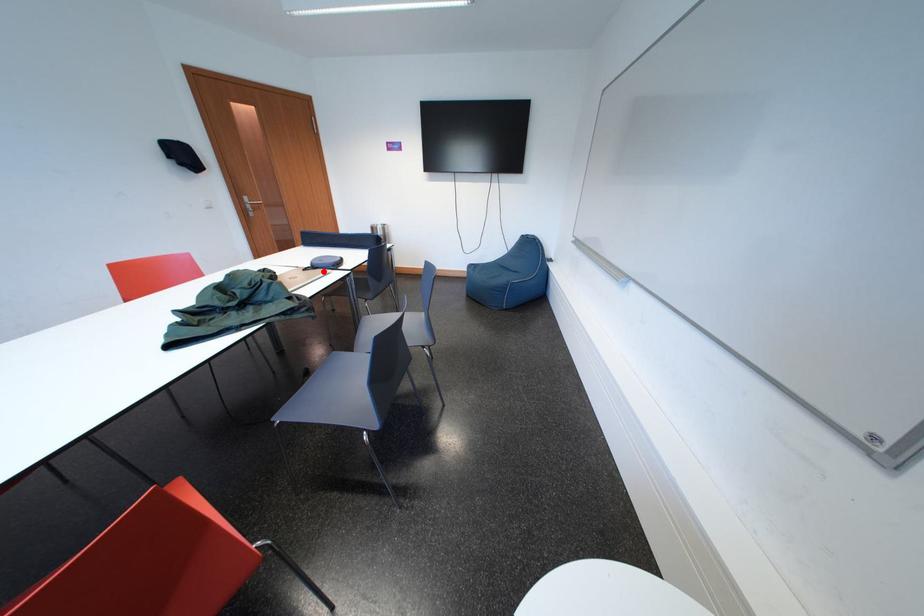
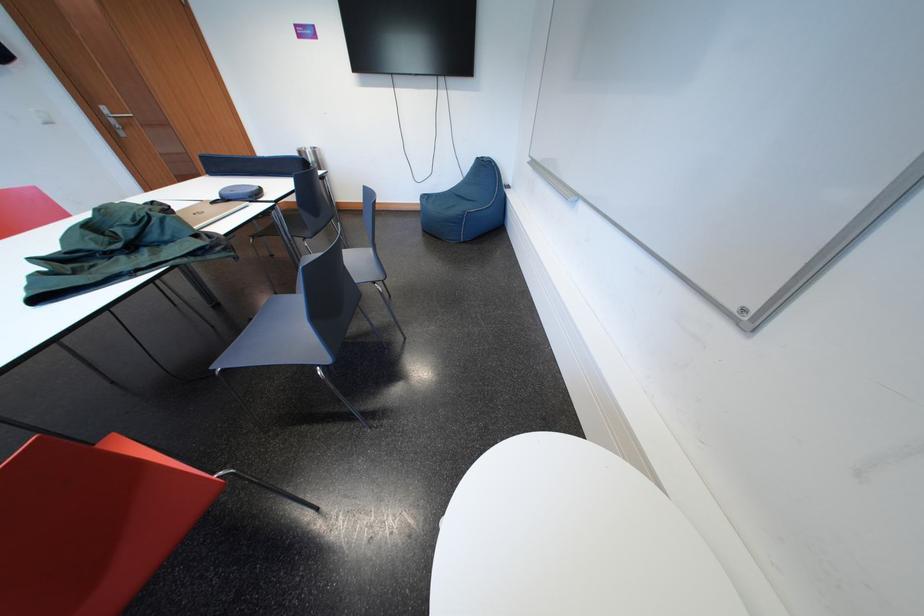
Question: I am providing you with two images of the same scene from different viewpoints. A red point is marked on the first image. Can you still see the location of the red point in image 2?

Choices:
 (A) Yes
 (B) No

Answer: (A)